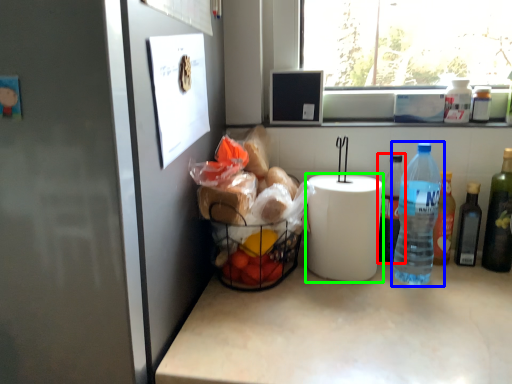
Question: Based on their relative distances, which object is farther from bottle (highlighted by a red box)? Choose from bottle (highlighted by a blue box) and paper towel (highlighted by a green box).

Choices:
 (A) bottle
 (B) paper towel

Answer: (B)